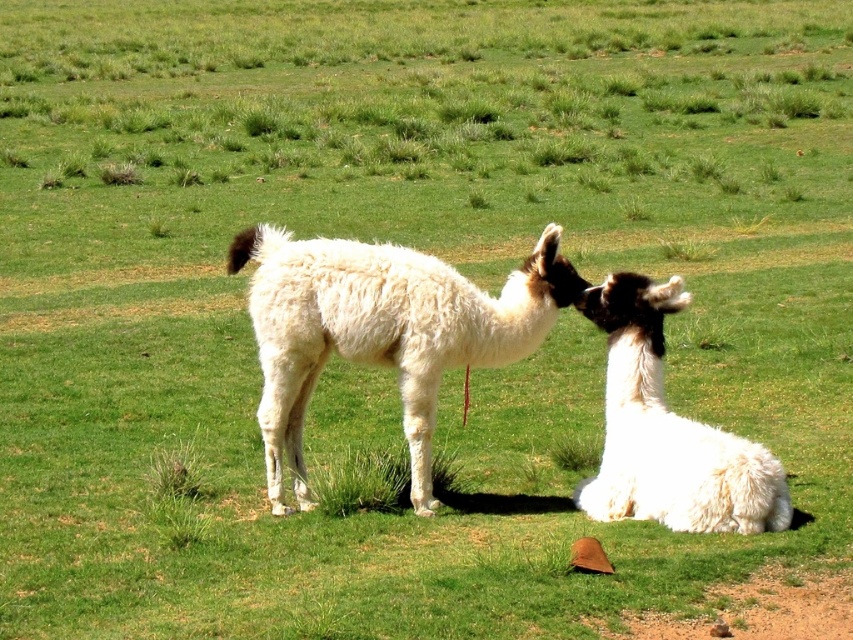
Who is positioned more to the left, white fluffy alpaca at center or white fluffy alpaca at lower right?

white fluffy alpaca at center

Where is `white fluffy alpaca at center`? This screenshot has height=640, width=853. white fluffy alpaca at center is located at coordinates (381, 330).

What do you see at coordinates (381, 330) in the screenshot? The width and height of the screenshot is (853, 640). I see `white fluffy alpaca at center` at bounding box center [381, 330].

You are a GUI agent. You are given a task and a screenshot of the screen. Output one action in this format:
    pyautogui.click(x=<x>, y=<y>)
    Task: Click on the white fluffy alpaca at center
    
    Given the screenshot: What is the action you would take?
    pyautogui.click(x=381, y=330)